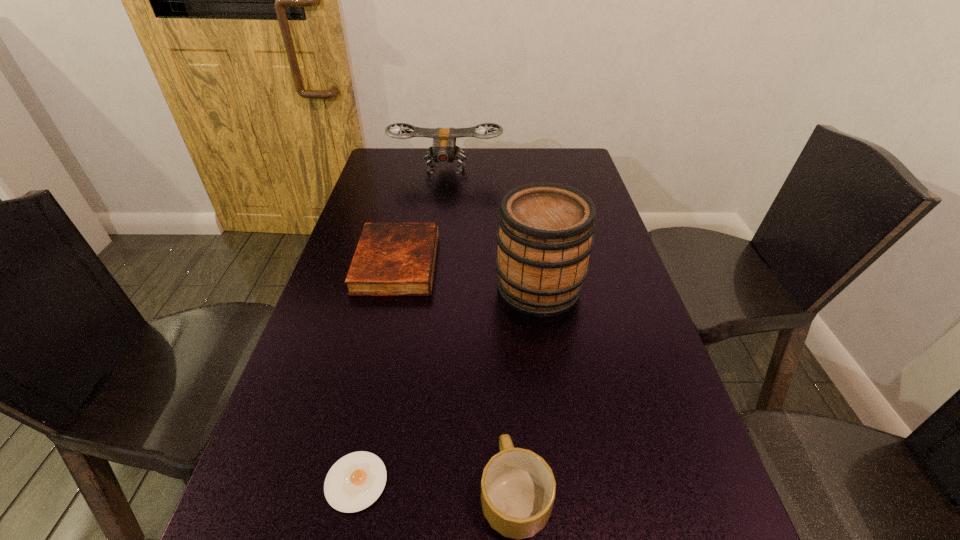
Locate an element on the screen. drone that is at the left edge is located at coordinates (444, 150).

At what (x,y) coordinates should I click in order to perform the action: click on Bible located at the left edge. Please return your answer as a coordinate pair (x, y). The width and height of the screenshot is (960, 540). Looking at the image, I should click on (391, 259).

You are a GUI agent. You are given a task and a screenshot of the screen. Output one action in this format:
    pyautogui.click(x=<x>, y=<y>)
    Task: Click on the egg yolk located at the left edge
    This screenshot has height=540, width=960.
    Given the screenshot: What is the action you would take?
    pyautogui.click(x=354, y=482)

Where is `object that is at the right edge`? The height and width of the screenshot is (540, 960). object that is at the right edge is located at coordinates (545, 236).

Identify the location of object present at the far left corner. Image resolution: width=960 pixels, height=540 pixels. (444, 150).

The image size is (960, 540). In order to click on free space at the far edge of the desktop in this screenshot , I will do `click(453, 167)`.

The height and width of the screenshot is (540, 960). Find the location of `free point at the left edge`. free point at the left edge is located at coordinates (358, 301).

Where is `vacant space at the right edge of the desktop`? The image size is (960, 540). vacant space at the right edge of the desktop is located at coordinates (x=640, y=535).

Where is `vacant space at the far left corner of the desktop`? The image size is (960, 540). vacant space at the far left corner of the desktop is located at coordinates (390, 171).

Where is `free space at the far right corner of the desktop`? This screenshot has height=540, width=960. free space at the far right corner of the desktop is located at coordinates (581, 174).